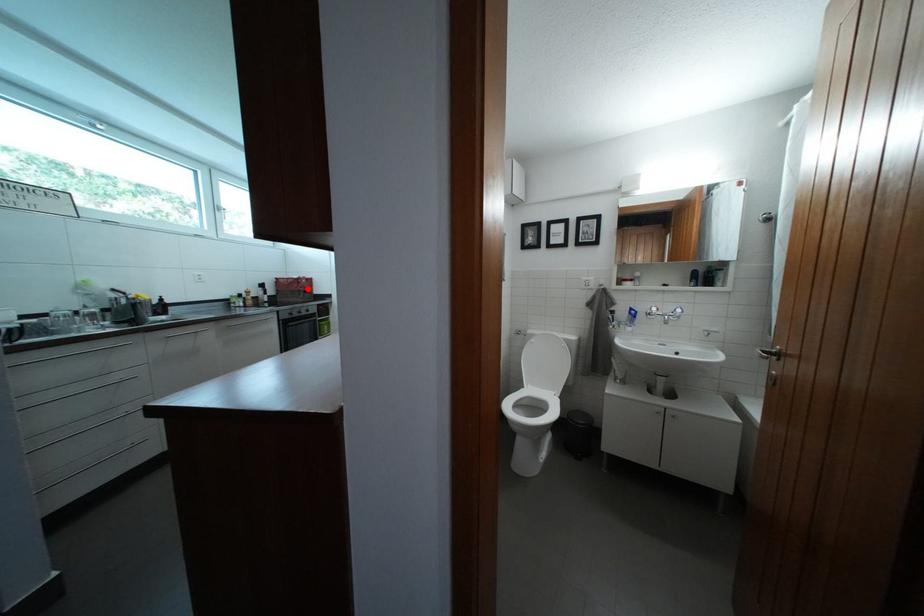
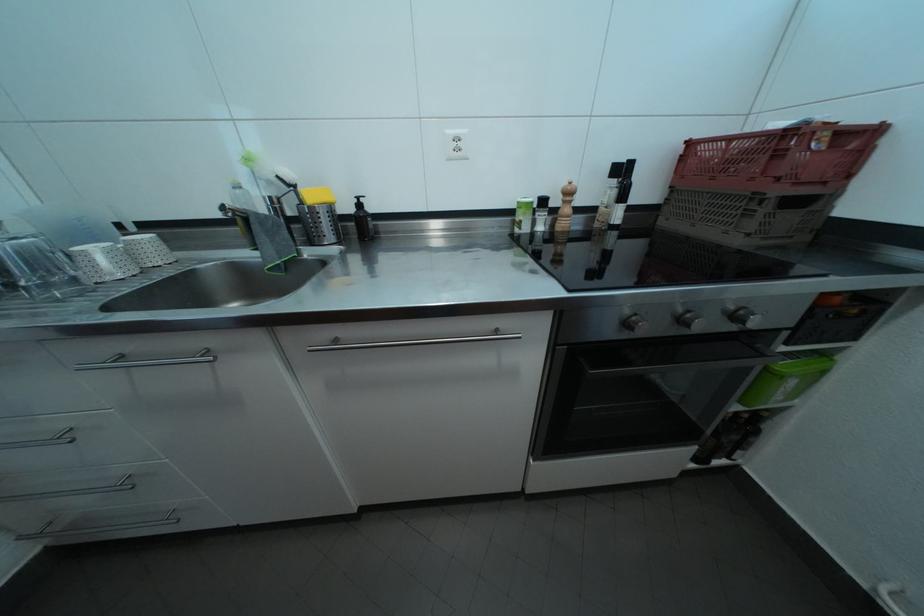
Where in the second image is the point corresponding to the highlighted location from the first image?

(787, 161)